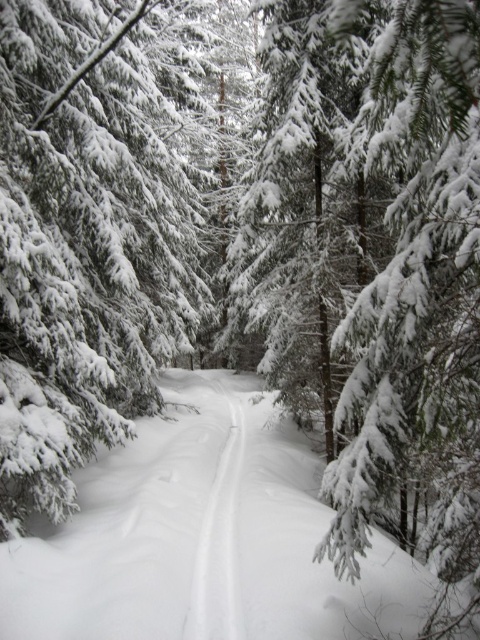
Measure the distance between green textured pine tree at center and white snow trail at center.

green textured pine tree at center and white snow trail at center are 6.16 meters apart.

Who is shorter, green textured pine tree at center or white snow trail at center?

Standing shorter between the two is white snow trail at center.

Who is more forward, (56, 84) or (225, 524)?

Point (225, 524) is more forward.

Find the location of a particular element. green textured pine tree at center is located at coordinates (88, 234).

Who is higher up, green textured pine tree at center or white fluffy snow at center?

green textured pine tree at center

Can you confirm if green textured pine tree at center is shorter than white fluffy snow at center?

In fact, green textured pine tree at center may be taller than white fluffy snow at center.

The image size is (480, 640). I want to click on green textured pine tree at center, so click(88, 234).

Is point (79, 564) positioned behind point (217, 632)?

That is True.

Is white fluffy snow at center bigger than white snow trail at center?

Yes, white fluffy snow at center is bigger than white snow trail at center.

Between point (160, 632) and point (235, 486), which one is positioned in front?

Point (160, 632) is in front.

Image resolution: width=480 pixels, height=640 pixels. I want to click on white fluffy snow at center, so click(x=204, y=538).